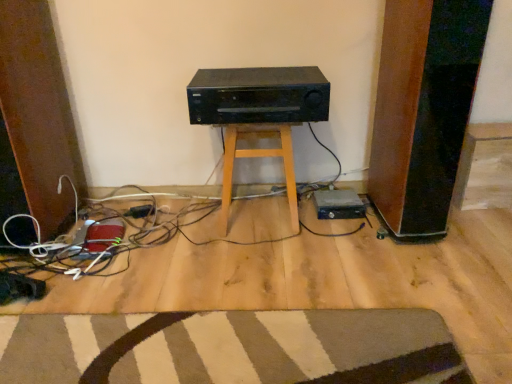
Where is `free space above striped carpet at lower center (from a real-world perspective)`? This screenshot has width=512, height=384. free space above striped carpet at lower center (from a real-world perspective) is located at coordinates (224, 350).